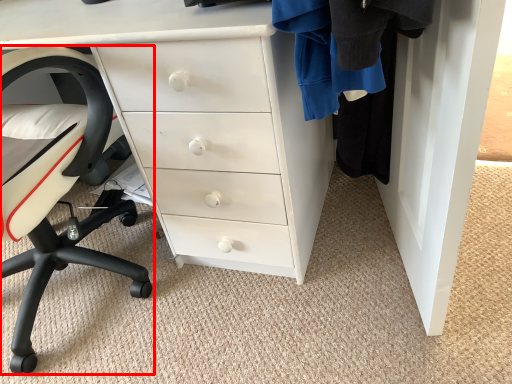
Question: From the image, what is the correct spatial relationship of chair (annotated by the red box) in relation to chest of drawers?

Choices:
 (A) right
 (B) left

Answer: (B)